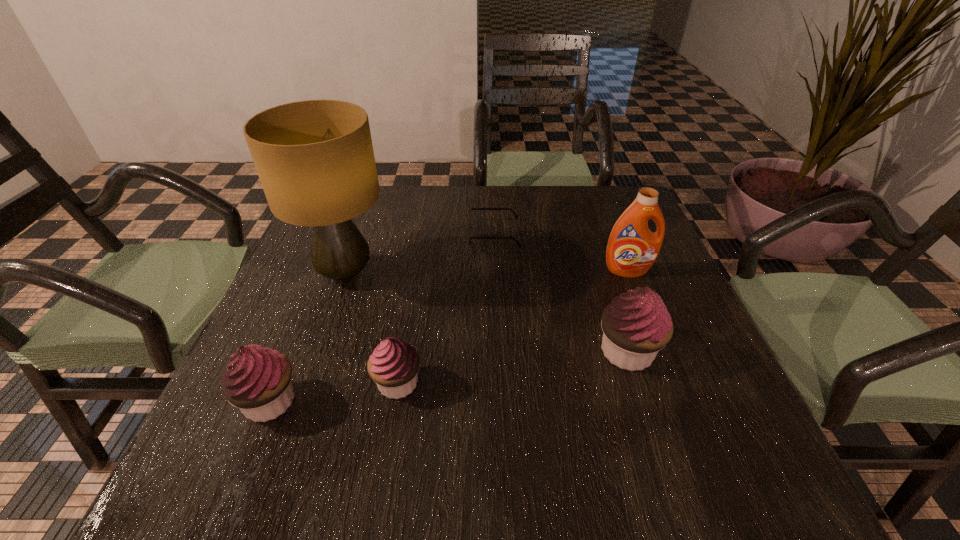
Find the location of a particular element. The height and width of the screenshot is (540, 960). the fourth tallest object is located at coordinates (257, 380).

Where is `the leftmost cupcake`? Image resolution: width=960 pixels, height=540 pixels. the leftmost cupcake is located at coordinates (257, 380).

In order to click on the second shortest object in this screenshot , I will do `click(393, 366)`.

Where is `the fourth object from right to left`? The image size is (960, 540). the fourth object from right to left is located at coordinates (393, 366).

Locate an element on the screen. This screenshot has width=960, height=540. the rightmost cupcake is located at coordinates (636, 325).

The height and width of the screenshot is (540, 960). I want to click on the third object from right to left, so click(469, 221).

You are a GUI agent. You are given a task and a screenshot of the screen. Output one action in this format:
    pyautogui.click(x=<x>, y=<y>)
    Task: Click on the spectacles
    The image size is (960, 540).
    Given the screenshot: What is the action you would take?
    pyautogui.click(x=469, y=221)

The image size is (960, 540). In order to click on lampshade in this screenshot , I will do click(315, 160).

You are a GUI agent. You are given a task and a screenshot of the screen. Output one action in this format:
    pyautogui.click(x=<x>, y=<y>)
    Task: Click on the second tallest object
    
    Given the screenshot: What is the action you would take?
    pyautogui.click(x=632, y=249)

Where is `vacant space located 0.330m on the back of the second shortest cupcake`? The image size is (960, 540). vacant space located 0.330m on the back of the second shortest cupcake is located at coordinates (326, 264).